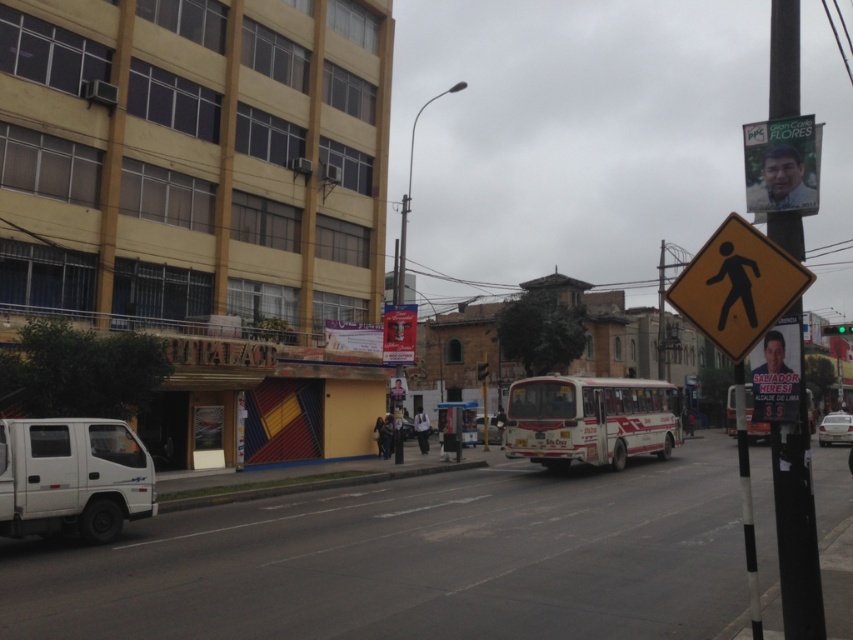
Question: Which point appears farthest from the camera in this image?

Choices:
 (A) (628, 444)
 (B) (848, 456)

Answer: (B)

Question: From the image, what is the correct spatial relationship of white/red painted bus at center in relation to yellow plastic pedestrian sign at upper right?

Choices:
 (A) right
 (B) left

Answer: (B)

Question: Is white matte van at lower left positioned at the back of green glass traffic light at upper right?

Choices:
 (A) yes
 (B) no

Answer: (B)

Question: Is white matte bus at center smaller than white matte car at center?

Choices:
 (A) yes
 (B) no

Answer: (A)

Question: Among these objects, which one is farthest from the camera?

Choices:
 (A) white matte bus at center
 (B) yellow reflective pedestrian crossing sign at upper right
 (C) white matte car at center

Answer: (A)

Question: Which point is farther to the camera?

Choices:
 (A) silver metallic sedan at right
 (B) white/red painted bus at center
 (C) metallic pole at right
 (D) white matte van at lower left

Answer: (A)